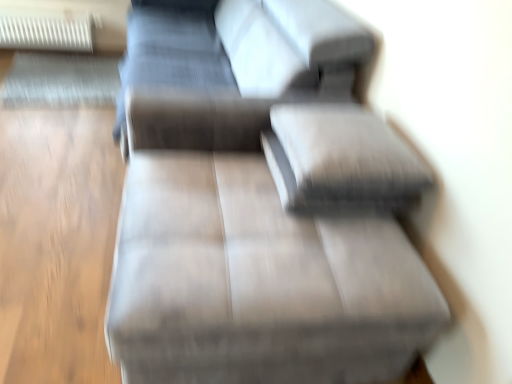
Question: Is textured gray pillow at center in contact with suede-like gray couch at center?

Choices:
 (A) yes
 (B) no

Answer: (B)

Question: From a real-world perspective, is textured gray pillow at center over suede-like gray couch at center?

Choices:
 (A) yes
 (B) no

Answer: (A)

Question: From the image's perspective, does textured gray pillow at center appear higher than suede-like gray couch at center?

Choices:
 (A) yes
 (B) no

Answer: (A)

Question: Considering the relative sizes of textured gray pillow at center and suede-like gray couch at center in the image provided, is textured gray pillow at center taller than suede-like gray couch at center?

Choices:
 (A) no
 (B) yes

Answer: (A)

Question: Considering the relative sizes of textured gray pillow at center and suede-like gray couch at center in the image provided, is textured gray pillow at center shorter than suede-like gray couch at center?

Choices:
 (A) no
 (B) yes

Answer: (B)

Question: Can you confirm if textured gray pillow at center is wider than suede-like gray couch at center?

Choices:
 (A) no
 (B) yes

Answer: (A)

Question: From the image's perspective, does suede-like gray couch at center appear higher than textured gray pillow at center?

Choices:
 (A) no
 (B) yes

Answer: (A)

Question: Is suede-like gray couch at center far away from textured gray pillow at center?

Choices:
 (A) yes
 (B) no

Answer: (B)

Question: Is suede-like gray couch at center at the right side of textured gray pillow at center?

Choices:
 (A) no
 (B) yes

Answer: (A)

Question: Is suede-like gray couch at center turned away from textured gray pillow at center?

Choices:
 (A) no
 (B) yes

Answer: (A)

Question: Is suede-like gray couch at center bigger than textured gray pillow at center?

Choices:
 (A) no
 (B) yes

Answer: (B)

Question: Considering the relative sizes of suede-like gray couch at center and textured gray pillow at center in the image provided, is suede-like gray couch at center taller than textured gray pillow at center?

Choices:
 (A) yes
 (B) no

Answer: (A)

Question: Does white plastic radiator at upper left have a larger size compared to textured gray pillow at center?

Choices:
 (A) yes
 (B) no

Answer: (A)